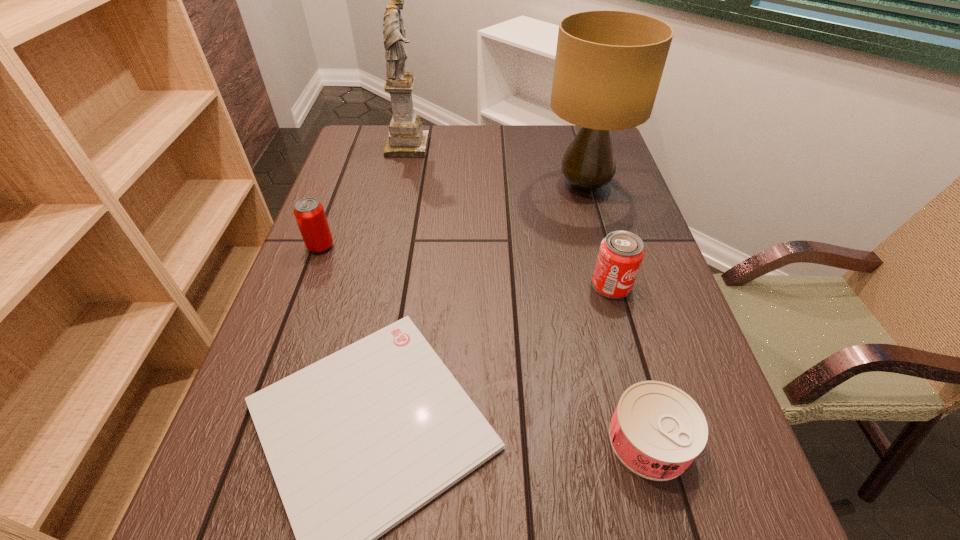
Where is `free space at the left edge of the desktop`? free space at the left edge of the desktop is located at coordinates (253, 455).

This screenshot has width=960, height=540. I want to click on free location at the right edge, so click(612, 182).

Where is `vacant space at the far right corner of the desktop`? Image resolution: width=960 pixels, height=540 pixels. vacant space at the far right corner of the desktop is located at coordinates (569, 142).

Where is `unoccupied area between the shortest can and the third farthest object`? The height and width of the screenshot is (540, 960). unoccupied area between the shortest can and the third farthest object is located at coordinates 485,343.

Where is `empty location between the nearest can and the farthest object`? empty location between the nearest can and the farthest object is located at coordinates (528, 293).

Identify the location of free space that is in between the third farthest object and the second nearest can. This screenshot has width=960, height=540. (467, 266).

Identify the location of free point between the fourth nearest object and the farthest object. The width and height of the screenshot is (960, 540). (364, 197).

You are a GUI agent. You are given a task and a screenshot of the screen. Output one action in this format:
    pyautogui.click(x=<x>, y=<y>)
    Task: Click on the free area in between the fifth tallest object and the sculpture
    
    Given the screenshot: What is the action you would take?
    pyautogui.click(x=528, y=293)

Identify the location of empty space between the sculpture and the fourth farthest object. The image size is (960, 540). (510, 216).

Locate an element on the screen. Image resolution: width=960 pixels, height=540 pixels. unoccupied position between the farthest object and the fifth nearest object is located at coordinates (496, 166).